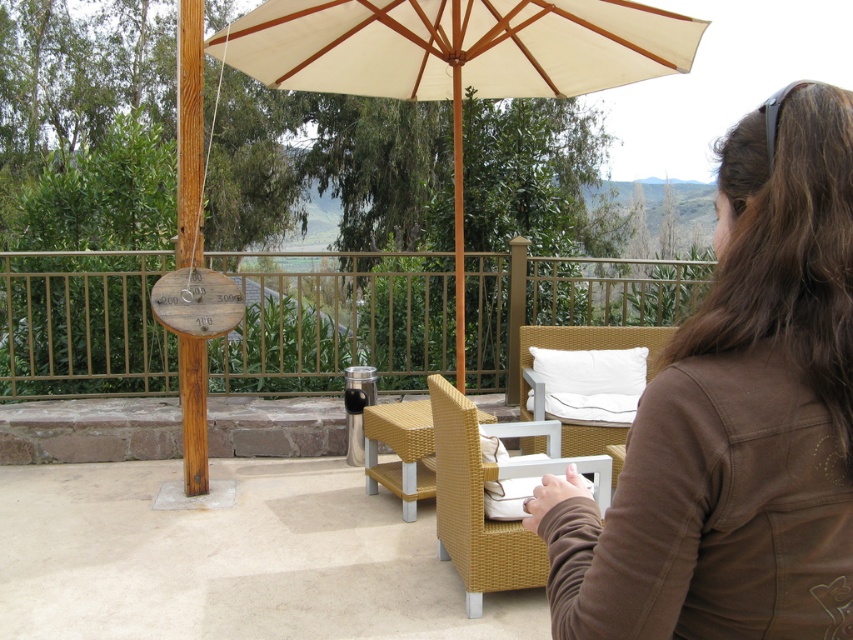
Consider the image. Can you confirm if white wicker chair at center is positioned to the right of woven rattan chair at center?

Correct, you'll find white wicker chair at center to the right of woven rattan chair at center.

Which is in front, point (569, 442) or point (368, 444)?

Positioned in front is point (569, 442).

This screenshot has height=640, width=853. Find the location of `white wicker chair at center`. white wicker chair at center is located at coordinates (595, 340).

Locate an element on the screen. This screenshot has height=640, width=853. white wicker chair at center is located at coordinates (595, 340).

Who is more distant from viewer, (x=810, y=509) or (x=401, y=406)?

Point (x=401, y=406)

Looking at this image, who is lower down, brown cotton jacket at upper right or woven rattan chair at center?

woven rattan chair at center is below.

Does point (788, 381) come behind point (397, 422)?

No, it is not.

Image resolution: width=853 pixels, height=640 pixels. What are the coordinates of `brown cotton jacket at upper right` in the screenshot? It's located at click(x=735, y=417).

Is woven wicker chair at center positioned at the back of woven rattan chair at center?

No.

Who is taller, woven wicker chair at center or woven rattan chair at center?

Standing taller between the two is woven wicker chair at center.

Where is `woven wicker chair at center`? This screenshot has height=640, width=853. woven wicker chair at center is located at coordinates (482, 496).